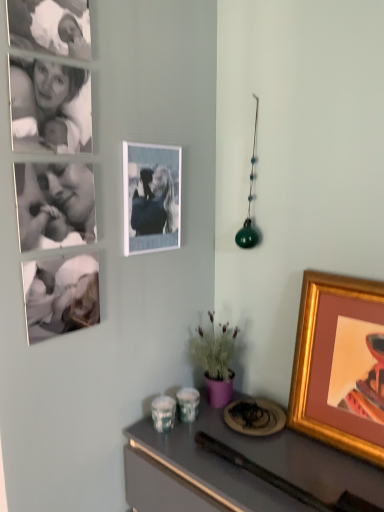
What are the coordinates of `metallic gray desk at lower right` in the screenshot? It's located at (235, 469).

Where is `gold-framed picture at right, which is counted as the first picture frame, starting from the right`? gold-framed picture at right, which is counted as the first picture frame, starting from the right is located at coordinates (340, 364).

This screenshot has width=384, height=512. Describe the element at coordinates (50, 106) in the screenshot. I see `black and white photograph of a person at upper left` at that location.

You are a GUI agent. You are given a task and a screenshot of the screen. Output one action in this format:
    pyautogui.click(x=<x>, y=<y>)
    Task: Click on the metallic gray desk at lower right
    
    Given the screenshot: What is the action you would take?
    pyautogui.click(x=235, y=469)

Looking at the image, does metallic gray desk at lower right seem bigger or smaller compared to matte white photo frame at upper center, the first picture frame in the top-to-bottom sequence?

Considering their sizes, metallic gray desk at lower right takes up more space than matte white photo frame at upper center, the first picture frame in the top-to-bottom sequence.

Considering the sizes of objects metallic gray desk at lower right and matte white photo frame at upper center, the first picture frame in the top-to-bottom sequence, in the image provided, who is taller, metallic gray desk at lower right or matte white photo frame at upper center, the first picture frame in the top-to-bottom sequence,?

metallic gray desk at lower right is taller.

In the scene shown: Which object is positioned more to the left, metallic gray desk at lower right or matte white photo frame at upper center, the second picture frame positioned from the bottom?

From the viewer's perspective, matte white photo frame at upper center, the second picture frame positioned from the bottom, appears more on the left side.

Based on the photo, could you measure the distance between metallic gray desk at lower right and matte white photo frame at upper center, which appears as the 1th picture frame when viewed from the left?

The distance of metallic gray desk at lower right from matte white photo frame at upper center, which appears as the 1th picture frame when viewed from the left, is 25.70 inches.

Considering the points (357, 442) and (25, 103), which point is behind, point (357, 442) or point (25, 103)?

The point (357, 442) is farther.

Is gold-framed picture at right, which ranks as the second picture frame in top-to-bottom order, next to black and white photograph of a person at upper left?

gold-framed picture at right, which ranks as the second picture frame in top-to-bottom order, is not next to black and white photograph of a person at upper left, and they're not touching.

Does gold-framed picture at right, which is counted as the first picture frame, starting from the right, lie in front of black and white photograph of a person at upper left?

No, it is behind black and white photograph of a person at upper left.

Considering the positions of point (164, 180) and point (63, 126), is point (164, 180) closer or farther from the camera than point (63, 126)?

Point (164, 180) is positioned farther from the camera compared to point (63, 126).

From the image's perspective, is matte white photo frame at upper center, the first picture frame in the top-to-bottom sequence, on black and white photograph of a person at upper left?

No, from the image's perspective, matte white photo frame at upper center, the first picture frame in the top-to-bottom sequence, is not on top of black and white photograph of a person at upper left.

Is matte white photo frame at upper center, the second picture frame positioned from the bottom, directly adjacent to black and white photograph of a person at upper left?

matte white photo frame at upper center, the second picture frame positioned from the bottom, is not next to black and white photograph of a person at upper left, and they're not touching.

Considering the positions of objects matte white photo frame at upper center, the first picture frame in the top-to-bottom sequence, and black and white photograph of a person at upper left in the image provided, who is more to the left, matte white photo frame at upper center, the first picture frame in the top-to-bottom sequence, or black and white photograph of a person at upper left?

black and white photograph of a person at upper left is more to the left.

Is matte white photo frame at upper center, which is the 2th picture frame in right-to-left order, behind metallic gray desk at lower right?

Yes.

Considering the sizes of objects matte white photo frame at upper center, the first picture frame in the top-to-bottom sequence, and metallic gray desk at lower right in the image provided, who is wider, matte white photo frame at upper center, the first picture frame in the top-to-bottom sequence, or metallic gray desk at lower right?

With larger width is metallic gray desk at lower right.

Which is closer, (142,224) or (179,478)?

Point (142,224) is positioned farther from the camera compared to point (179,478).

Considering the relative sizes of matte white photo frame at upper center, which is the 2th picture frame in right-to-left order, and metallic gray desk at lower right in the image provided, is matte white photo frame at upper center, which is the 2th picture frame in right-to-left order, smaller than metallic gray desk at lower right?

Correct, matte white photo frame at upper center, which is the 2th picture frame in right-to-left order, occupies less space than metallic gray desk at lower right.

From a real-world perspective, is black and white photograph of a person at upper left positioned under matte white photo frame at upper center, the second picture frame positioned from the bottom, based on gravity?

No, from a real-world perspective, black and white photograph of a person at upper left is not under matte white photo frame at upper center, the second picture frame positioned from the bottom.

From the image's perspective, which is above, black and white photograph of a person at upper left or matte white photo frame at upper center, the second picture frame positioned from the bottom?

black and white photograph of a person at upper left appears higher in the image.

Does black and white photograph of a person at upper left have a greater height compared to matte white photo frame at upper center, which appears as the 1th picture frame when viewed from the left?

Incorrect, the height of black and white photograph of a person at upper left is not larger of that of matte white photo frame at upper center, which appears as the 1th picture frame when viewed from the left.

Does metallic gray desk at lower right come behind gold-framed picture at right, which is counted as the first picture frame, starting from the right?

No.

Is metallic gray desk at lower right oriented towards gold-framed picture at right, the second picture frame positioned from the left?

No, metallic gray desk at lower right does not turn towards gold-framed picture at right, the second picture frame positioned from the left.

From the image's perspective, which is below, metallic gray desk at lower right or gold-framed picture at right, which is counted as the first picture frame, starting from the right?

metallic gray desk at lower right.

Is metallic gray desk at lower right not near black and white photograph of a person at upper left?

metallic gray desk at lower right is actually quite close to black and white photograph of a person at upper left.

What's the angular difference between metallic gray desk at lower right and black and white photograph of a person at upper left's facing directions?

89.1 degrees separate the facing orientations of metallic gray desk at lower right and black and white photograph of a person at upper left.

In the scene shown: Do you think metallic gray desk at lower right is within black and white photograph of a person at upper left, or outside of it?

metallic gray desk at lower right is outside black and white photograph of a person at upper left.

Considering the points (150, 456) and (85, 75), which point is behind, point (150, 456) or point (85, 75)?

The point (150, 456) is more distant.

Locate an element on the screen. desk located in front of the matte white photo frame at upper center, which is the 2th picture frame in right-to-left order is located at coordinates (235, 469).

This screenshot has height=512, width=384. Identify the location of person above the gold-framed picture at right, acting as the 1th picture frame starting from the bottom (from a real-world perspective). (50, 106).

From the image, which object appears to be nearer to matte white photo frame at upper center, the second picture frame positioned from the bottom, metallic gray desk at lower right or gold-framed picture at right, acting as the 1th picture frame starting from the bottom?

Based on the image, gold-framed picture at right, acting as the 1th picture frame starting from the bottom, appears to be nearer to matte white photo frame at upper center, the second picture frame positioned from the bottom.

Based on their spatial positions, is matte white photo frame at upper center, which is the 2th picture frame in right-to-left order, or metallic gray desk at lower right closer to black and white photograph of a person at upper left?

Based on the image, matte white photo frame at upper center, which is the 2th picture frame in right-to-left order, appears to be nearer to black and white photograph of a person at upper left.

Looking at the image, which one is located closer to metallic gray desk at lower right, gold-framed picture at right, which ranks as the second picture frame in top-to-bottom order, or matte white photo frame at upper center, which appears as the 1th picture frame when viewed from the left?

gold-framed picture at right, which ranks as the second picture frame in top-to-bottom order, lies closer to metallic gray desk at lower right than the other object.

When comparing their distances from gold-framed picture at right, the second picture frame positioned from the left, does matte white photo frame at upper center, which is the 2th picture frame in right-to-left order, or metallic gray desk at lower right seem further?

Based on the image, matte white photo frame at upper center, which is the 2th picture frame in right-to-left order, appears to be further to gold-framed picture at right, the second picture frame positioned from the left.

From the image, which object appears to be nearer to matte white photo frame at upper center, which appears as the 1th picture frame when viewed from the left, gold-framed picture at right, which is counted as the first picture frame, starting from the right, or metallic gray desk at lower right?

The object closer to matte white photo frame at upper center, which appears as the 1th picture frame when viewed from the left, is gold-framed picture at right, which is counted as the first picture frame, starting from the right.

Looking at the image, which one is located further to matte white photo frame at upper center, the first picture frame in the top-to-bottom sequence, metallic gray desk at lower right or black and white photograph of a person at upper left?

metallic gray desk at lower right lies further to matte white photo frame at upper center, the first picture frame in the top-to-bottom sequence, than the other object.

Considering their positions, is black and white photograph of a person at upper left positioned closer to matte white photo frame at upper center, the second picture frame positioned from the bottom, than gold-framed picture at right, which is counted as the first picture frame, starting from the right?

black and white photograph of a person at upper left is closer to matte white photo frame at upper center, the second picture frame positioned from the bottom.

Which object lies nearer to the anchor point metallic gray desk at lower right, matte white photo frame at upper center, the second picture frame positioned from the bottom, or gold-framed picture at right, acting as the 1th picture frame starting from the bottom?

The object closer to metallic gray desk at lower right is gold-framed picture at right, acting as the 1th picture frame starting from the bottom.

Where is `picture frame situated between black and white photograph of a person at upper left and gold-framed picture at right, which is counted as the first picture frame, starting from the right, from left to right`? The width and height of the screenshot is (384, 512). picture frame situated between black and white photograph of a person at upper left and gold-framed picture at right, which is counted as the first picture frame, starting from the right, from left to right is located at coordinates (151, 197).

The image size is (384, 512). What are the coordinates of `picture frame between matte white photo frame at upper center, the second picture frame positioned from the bottom, and metallic gray desk at lower right in the up-down direction` in the screenshot? It's located at (340, 364).